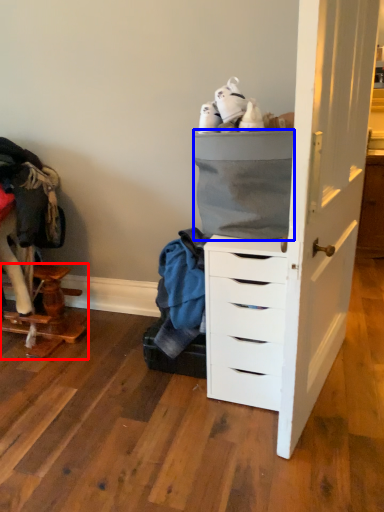
Question: Among these objects, which one is farthest to the camera, furniture (highlighted by a red box) or cabinetry (highlighted by a blue box)?

Choices:
 (A) furniture
 (B) cabinetry

Answer: (A)